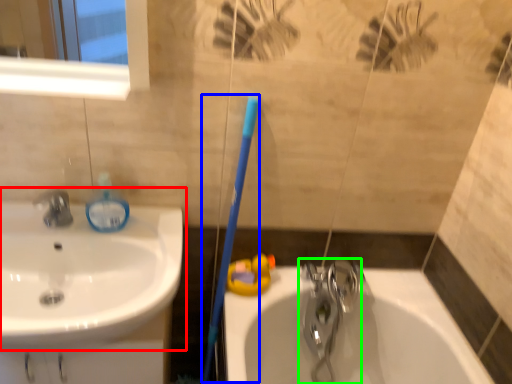
Question: Which is farther away from sink (highlighted by a red box)? toothbrush (highlighted by a blue box) or tap (highlighted by a green box)?

Choices:
 (A) toothbrush
 (B) tap

Answer: (B)